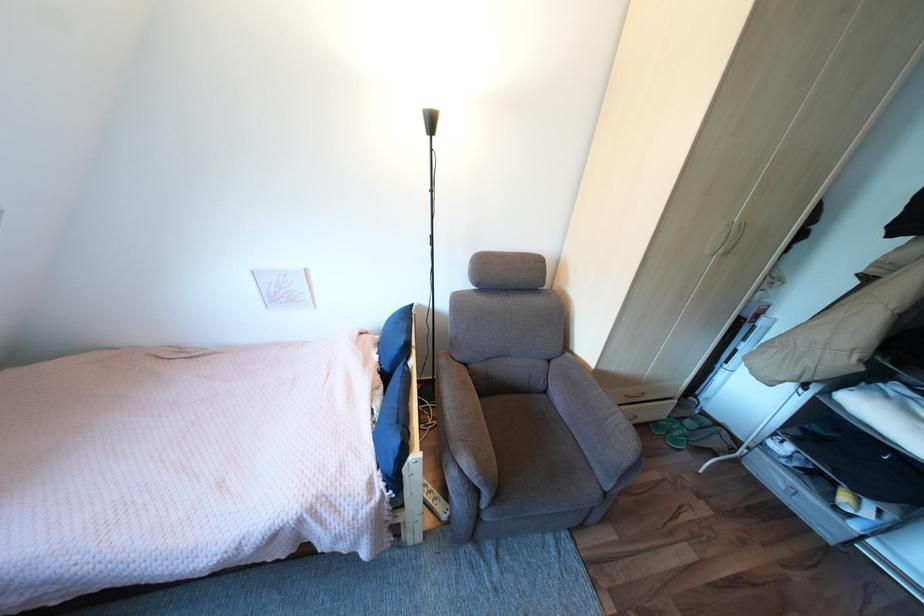
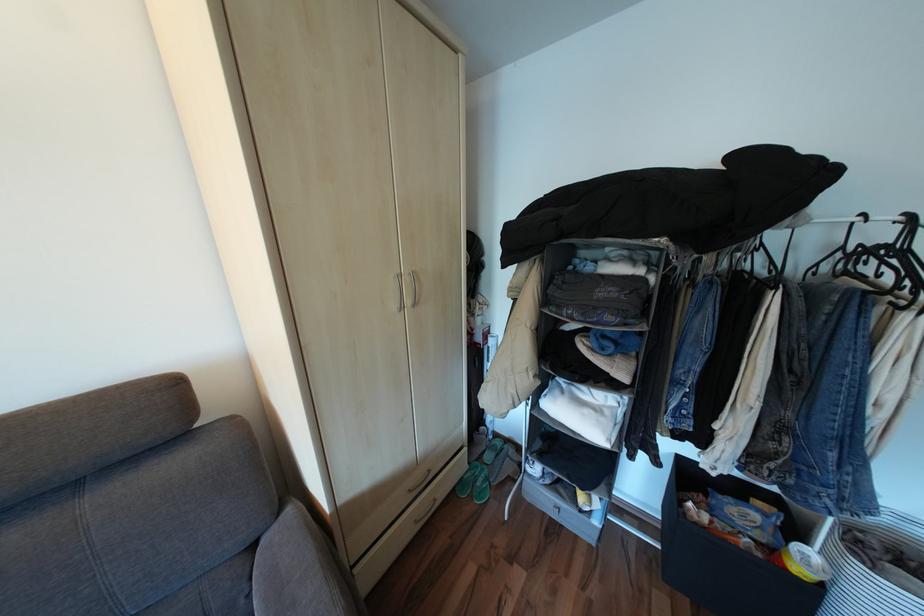
In the second image, find the point that corresponds to pixel 675 437 in the first image.

(481, 496)